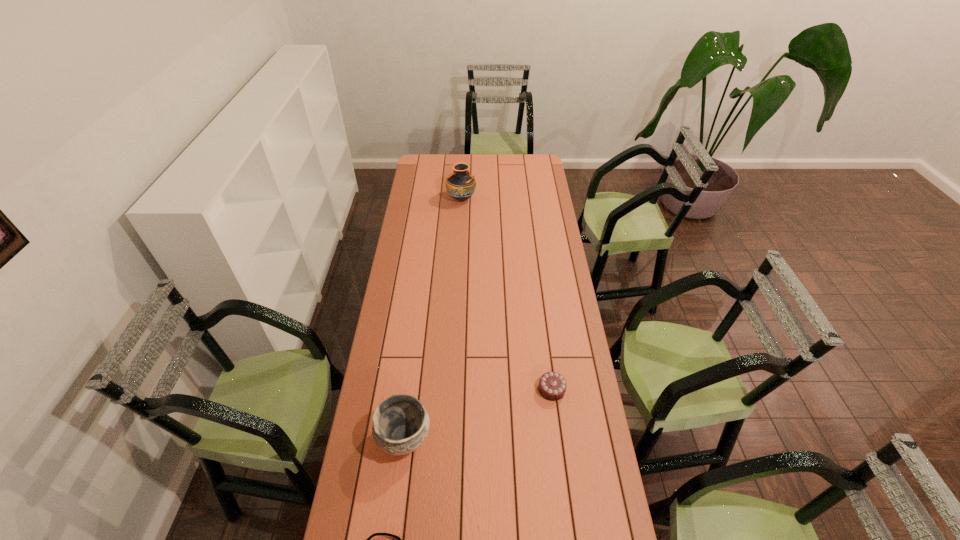
You are a GUI agent. You are given a task and a screenshot of the screen. Output one action in this format:
    pyautogui.click(x=<x>, y=<y>)
    Task: Click on the object that is the third closest one to the wristband
    Image resolution: width=960 pixels, height=540 pixels.
    Given the screenshot: What is the action you would take?
    pyautogui.click(x=460, y=185)